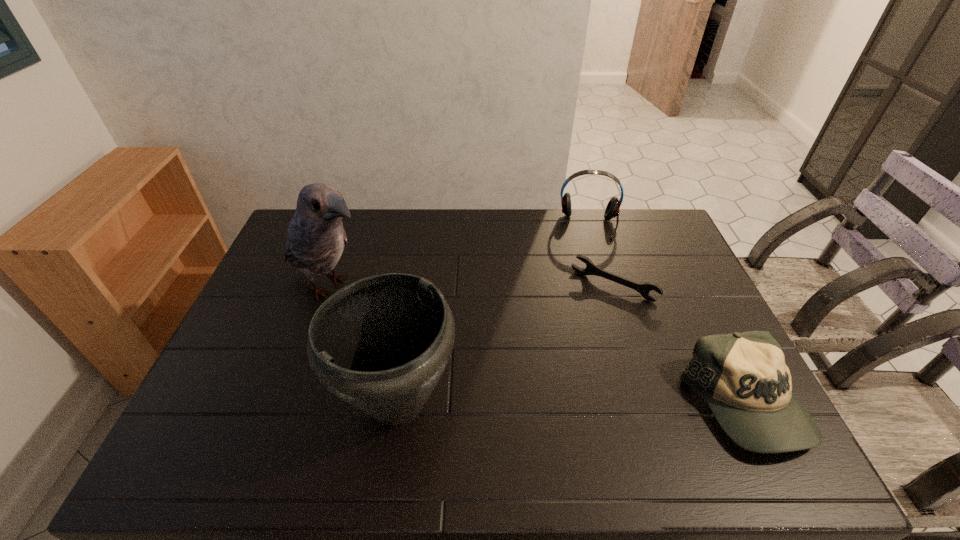
In order to click on free spot on the desktop that is between the fourth shortest object and the fourth tallest object and is positioned on the front-facing side of the tallest object in this screenshot , I will do `click(564, 404)`.

Where is `free space on the desktop that is between the second tallest object and the fourth tallest object and is positioned with the microphone attached to the side of the headset`? Image resolution: width=960 pixels, height=540 pixels. free space on the desktop that is between the second tallest object and the fourth tallest object and is positioned with the microphone attached to the side of the headset is located at coordinates (595, 404).

Identify the location of vacant space on the desktop that is between the second tallest object and the second shortest object and is positioned on the open ends of the shortest object. (541, 404).